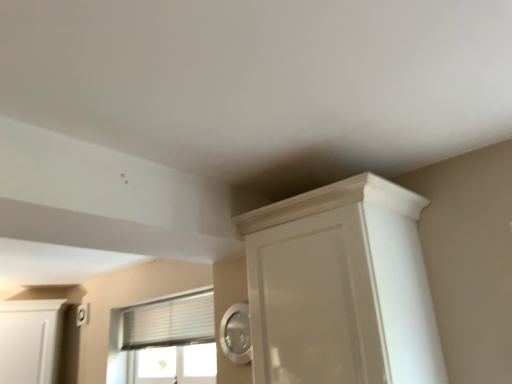
Question: Looking at their shapes, would you say white matte cabinet at left is wider or thinner than white glossy cupboard at upper right?

Choices:
 (A) thin
 (B) wide

Answer: (A)

Question: In the image, is white matte cabinet at left on the left side or the right side of white glossy cupboard at upper right?

Choices:
 (A) left
 (B) right

Answer: (A)

Question: Based on their relative distances, which object is farther from the white matte cabinet at left?

Choices:
 (A) white textured window at center
 (B) white glossy cupboard at upper right

Answer: (B)

Question: Which object is the farthest from the white textured window at center?

Choices:
 (A) white matte cabinet at left
 (B) white glossy cupboard at upper right

Answer: (B)